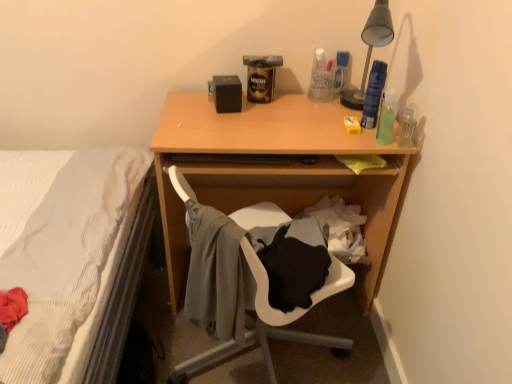
Where is `vacant region to the left of translucent plastic bottle at upper right, placed as the 1th bottle when sorted from back to front`? Image resolution: width=512 pixels, height=384 pixels. vacant region to the left of translucent plastic bottle at upper right, placed as the 1th bottle when sorted from back to front is located at coordinates (293, 101).